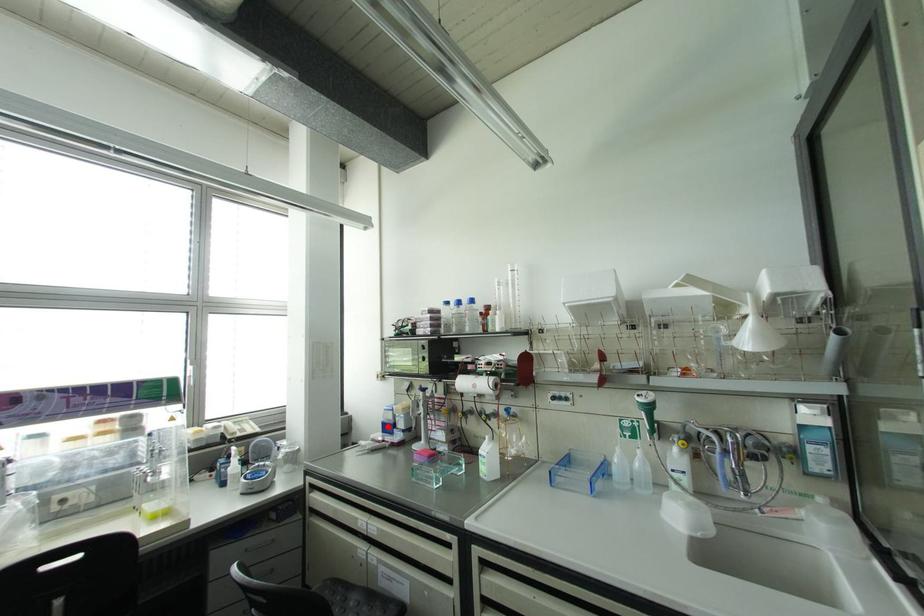
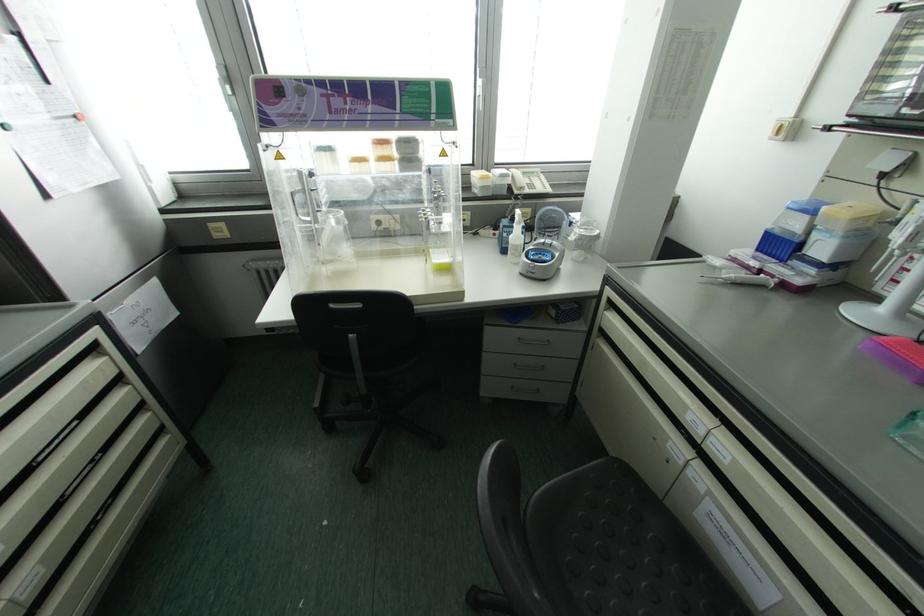
The point at the highlighted location is marked in the first image. Where is the corresponding point in the second image?

(777, 245)